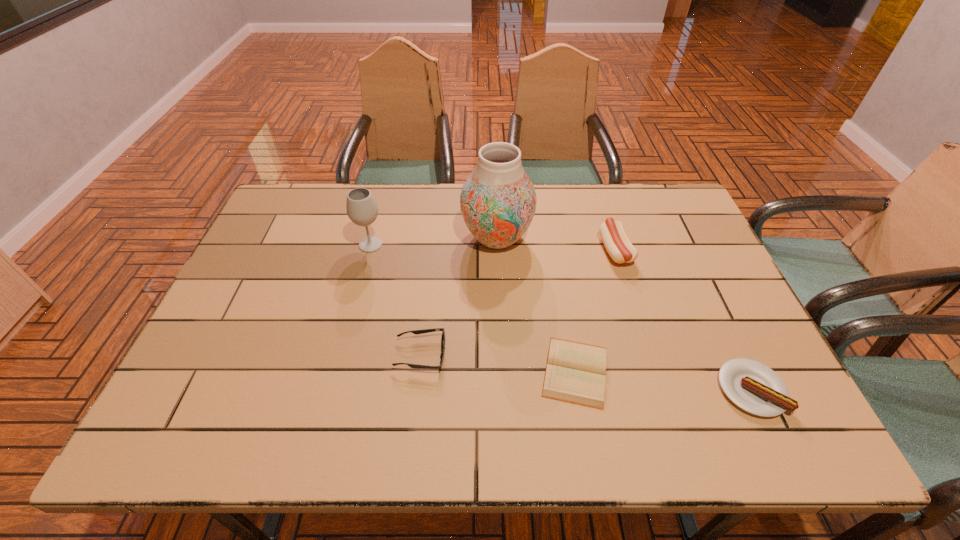
You are a GUI agent. You are given a task and a screenshot of the screen. Output one action in this format:
    pyautogui.click(x=<x>, y=<y>)
    Task: Click on the free space at the far edge
    
    Given the screenshot: What is the action you would take?
    pyautogui.click(x=391, y=226)

In the image, there is a desktop. Identify the location of vacant space at the near edge. The height and width of the screenshot is (540, 960). (450, 439).

In the image, there is a desktop. At what (x,y) coordinates should I click in order to perform the action: click on vacant space at the left edge. Please return your answer as a coordinate pair (x, y). This screenshot has height=540, width=960. Looking at the image, I should click on (299, 234).

Identify the location of free region at the right edge of the desktop. This screenshot has width=960, height=540. (679, 261).

In the image, there is a desktop. In order to click on vacant region at the far right corner in this screenshot , I will do `click(663, 227)`.

What are the coordinates of `vacant space in between the fifth object from right to left and the tallest object` in the screenshot? It's located at (459, 296).

The height and width of the screenshot is (540, 960). In order to click on free area in between the second object from left to right and the taller sausage in this screenshot , I will do `click(518, 302)`.

This screenshot has width=960, height=540. I want to click on free spot between the right sausage and the leftmost object, so click(x=561, y=317).

The width and height of the screenshot is (960, 540). Identify the location of vacant area between the fifth object from right to left and the vase. (459, 296).

You are a GUI agent. You are given a task and a screenshot of the screen. Output one action in this format:
    pyautogui.click(x=<x>, y=<y>)
    Task: Click on the blank region between the taller sausage and the shortest object
    The image size is (960, 540).
    Given the screenshot: What is the action you would take?
    pyautogui.click(x=595, y=310)